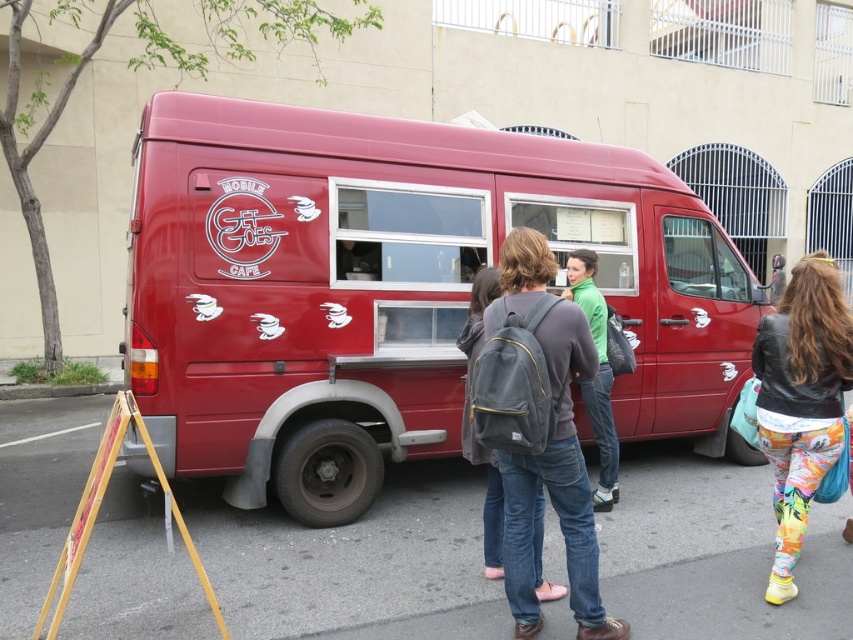
Question: Among these objects, which one is farthest from the camera?

Choices:
 (A) matte red van at center
 (B) green matte jacket at center

Answer: (B)

Question: Based on their relative distances, which object is nearer to the denim jeans at center?

Choices:
 (A) floral leggings at lower right
 (B) green matte jacket at center
 (C) matte red van at center

Answer: (A)

Question: Is denim jeans at center thinner than floral leggings at lower right?

Choices:
 (A) yes
 (B) no

Answer: (B)

Question: Does matte red van at center appear on the left side of denim jeans at center?

Choices:
 (A) yes
 (B) no

Answer: (B)

Question: Which of the following is the closest to the observer?

Choices:
 (A) denim jeans at center
 (B) floral leggings at lower right
 (C) green matte jacket at center

Answer: (A)

Question: Does matte red van at center have a lesser width compared to floral leggings at lower right?

Choices:
 (A) no
 (B) yes

Answer: (A)